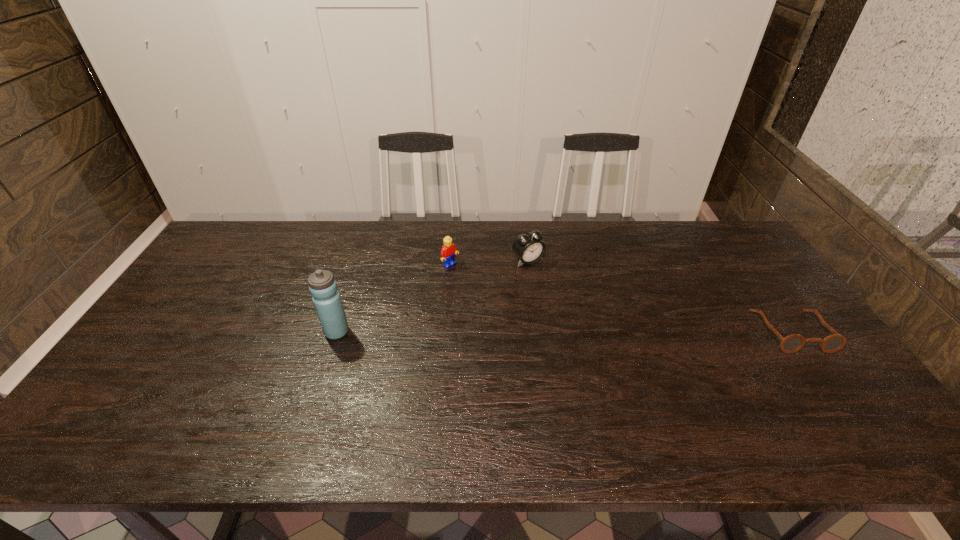
At what (x,y) coordinates should I click in order to perform the action: click on empty location between the leftmost object and the alarm clock. Please return your answer as a coordinate pair (x, y). The height and width of the screenshot is (540, 960). Looking at the image, I should click on (432, 296).

Locate an element on the screen. This screenshot has width=960, height=540. empty space between the alarm clock and the shortest object is located at coordinates (660, 296).

Identify the location of object that ranks as the third closest to the Lego. This screenshot has width=960, height=540. click(x=792, y=343).

Find the location of a particular element. Image resolution: width=960 pixels, height=540 pixels. the third closest object to the third object from left to right is located at coordinates (792, 343).